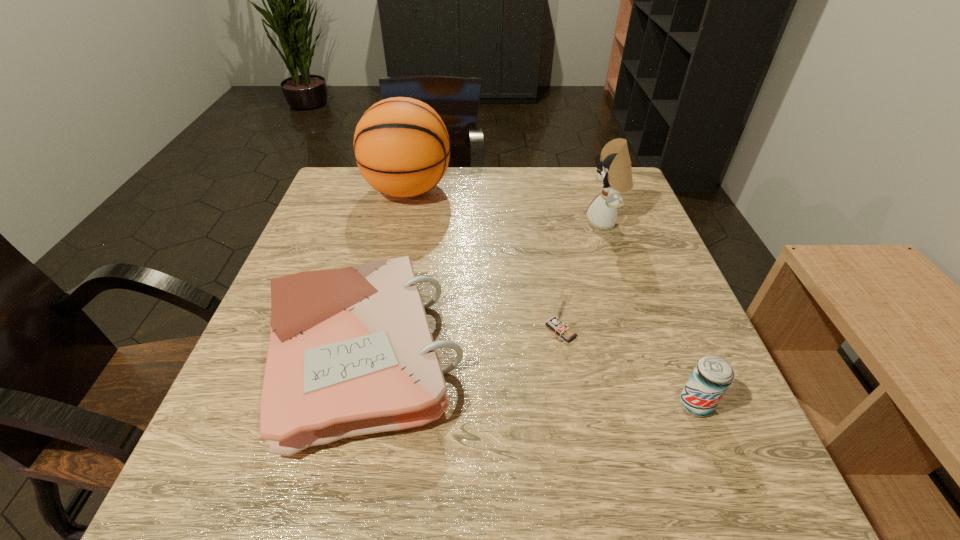
You are a GUI agent. You are given a task and a screenshot of the screen. Output one action in this format:
    pyautogui.click(x=<x>, y=<y>)
    Task: Click on the unoccupied position between the beer can and the doll
    
    Given the screenshot: What is the action you would take?
    pyautogui.click(x=650, y=313)

Find the location of a particular element. The image size is (960, 540). free space between the third object from right to left and the phonebook is located at coordinates (460, 343).

Identify the location of free spot between the shortest object and the beer can. (528, 380).

Find the location of a particular element. The image size is (960, 540). free space between the third object from right to left and the basketball is located at coordinates (484, 260).

Where is `free space that is in between the beer can and the shortest object`? free space that is in between the beer can and the shortest object is located at coordinates (528, 380).

This screenshot has height=540, width=960. Find the location of `free space that is in between the shortest object and the doll`. free space that is in between the shortest object and the doll is located at coordinates (483, 288).

At what (x,y) coordinates should I click in order to perform the action: click on empty space between the basketball and the doll. Please return your answer as a coordinate pair (x, y). Looking at the image, I should click on (506, 206).

This screenshot has width=960, height=540. What are the coordinates of `vacant space that's between the matchbox and the shortest object` in the screenshot? It's located at (460, 343).

Identify the location of vacant space in between the beer can and the third object from right to left. The height and width of the screenshot is (540, 960). (628, 368).

Locate an element on the screen. the third closest object to the basketball is located at coordinates (556, 323).